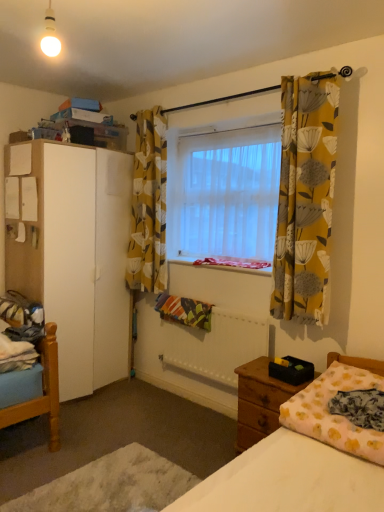
Question: Can you confirm if pink floral blanket at lower right is bigger than wooden nightstand at lower right?

Choices:
 (A) no
 (B) yes

Answer: (A)

Question: Considering the relative positions of pink floral blanket at lower right and wooden nightstand at lower right in the image provided, is pink floral blanket at lower right in front of wooden nightstand at lower right?

Choices:
 (A) no
 (B) yes

Answer: (B)

Question: Does pink floral blanket at lower right have a smaller size compared to wooden nightstand at lower right?

Choices:
 (A) yes
 (B) no

Answer: (A)

Question: Is pink floral blanket at lower right at the right side of wooden nightstand at lower right?

Choices:
 (A) yes
 (B) no

Answer: (A)

Question: Is pink floral blanket at lower right turned away from wooden nightstand at lower right?

Choices:
 (A) no
 (B) yes

Answer: (A)

Question: Is pink floral blanket at lower right beside wooden nightstand at lower right?

Choices:
 (A) yes
 (B) no

Answer: (B)

Question: Is translucent fabric window at center looking in the opposite direction of yellow floral fabric curtain at upper center, marked as the first curtain in a back-to-front arrangement?

Choices:
 (A) no
 (B) yes

Answer: (A)

Question: From a real-world perspective, is translucent fabric window at center physically above yellow floral fabric curtain at upper center, the 1th curtain positioned from the left?

Choices:
 (A) yes
 (B) no

Answer: (A)

Question: Considering the relative sizes of translucent fabric window at center and yellow floral fabric curtain at upper center, the 1th curtain positioned from the left, in the image provided, is translucent fabric window at center thinner than yellow floral fabric curtain at upper center, the 1th curtain positioned from the left,?

Choices:
 (A) yes
 (B) no

Answer: (B)

Question: Can you confirm if translucent fabric window at center is smaller than yellow floral fabric curtain at upper center, the second curtain viewed from the front?

Choices:
 (A) yes
 (B) no

Answer: (B)

Question: Can you confirm if translucent fabric window at center is positioned to the right of yellow floral fabric curtain at upper center, the 1th curtain positioned from the left?

Choices:
 (A) no
 (B) yes

Answer: (B)

Question: From the image's perspective, is translucent fabric window at center above yellow floral fabric curtain at upper center, the second curtain viewed from the front?

Choices:
 (A) yes
 (B) no

Answer: (A)

Question: Is wooden nightstand at lower right closer to the viewer compared to yellow floral fabric curtain at right, which ranks as the first curtain in right-to-left order?

Choices:
 (A) yes
 (B) no

Answer: (B)